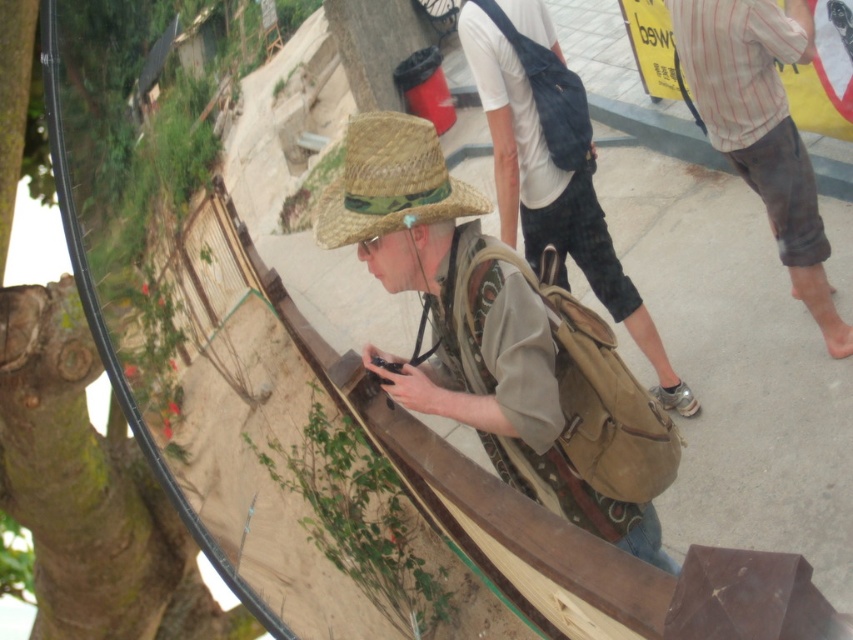
You are standing in a park and see the matte straw hat at center and the green rough bark tree at left. Which object is closer to you?

The matte straw hat at center is closer to you because it is positioned over the green rough bark tree at left, indicating it is in front of it.

You are planning to take a photo of the person wearing the matte straw hat at center and the striped cotton shirt at upper right. Which object should you focus on first if you want to capture both in the same frame without moving the camera?

You should focus on the matte straw hat at center first because its width is larger than the striped cotton shirt at upper right, so it will occupy more space in the frame, ensuring both are captured without needing to adjust the camera position.

You are trying to take a photo of the matte brown backpack at center without the matte straw hat at center blocking the view. Is this possible given their positions?

The matte straw hat at center is in front of the matte brown backpack at center, so it would block the view. You cannot take a photo of the matte brown backpack at center without the matte straw hat at center blocking the view.